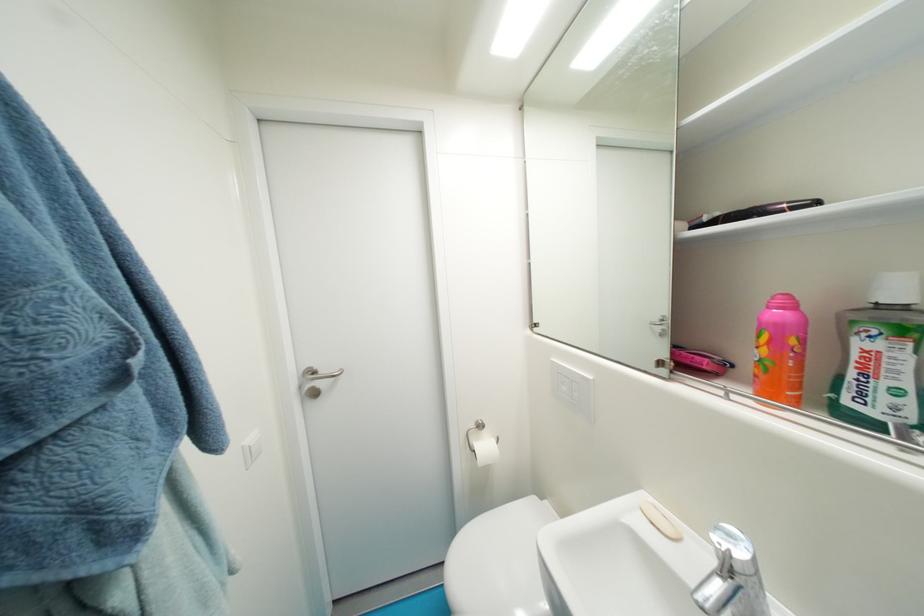
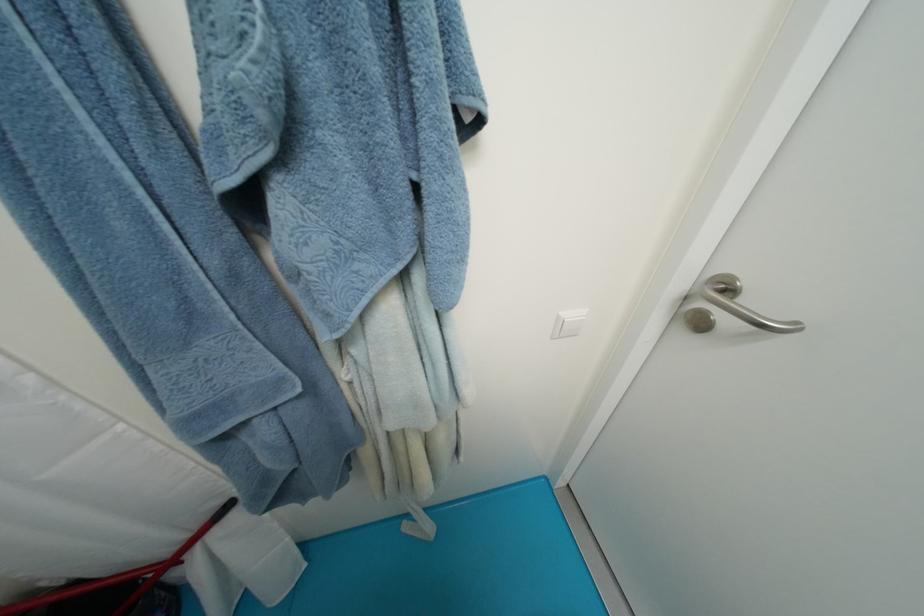
The first image is from the beginning of the video and the second image is from the end. How did the camera likely rotate when shooting the video?

The camera rotated toward left-down.